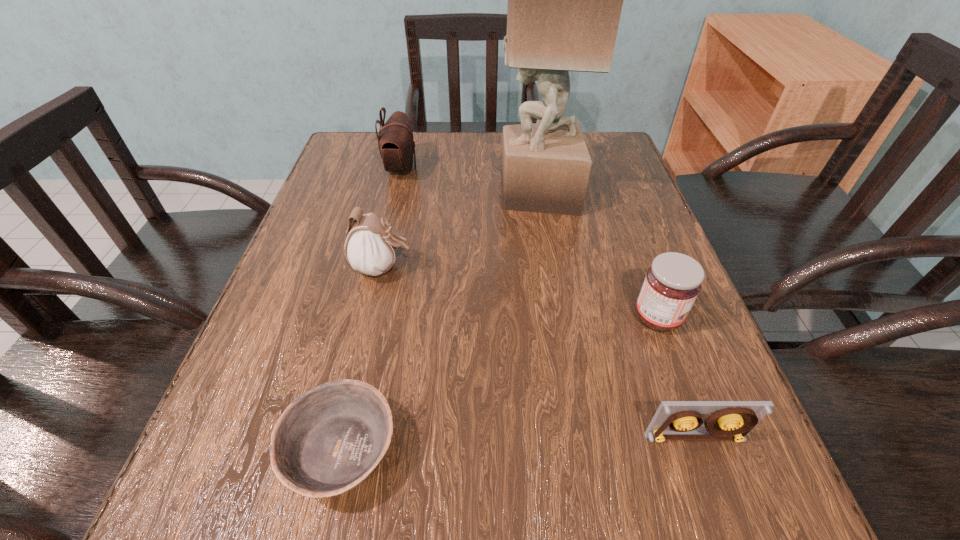
The image size is (960, 540). I want to click on vacant area situated with the flap open on the farther pouch, so click(x=503, y=168).

Locate an element on the screen. The height and width of the screenshot is (540, 960). free space located on the front-facing side of the third farthest object is located at coordinates (624, 268).

Locate an element on the screen. free space located on the left of the jam is located at coordinates (475, 318).

Identify the location of vacant space located at the front of the fifth tallest object with visible reels. Image resolution: width=960 pixels, height=540 pixels. (730, 534).

Image resolution: width=960 pixels, height=540 pixels. I want to click on free space located on the right of the shortest object, so click(x=436, y=451).

At what (x,y) coordinates should I click in order to perform the action: click on sculpture positioned at the far edge. Please return your answer as a coordinate pair (x, y). Image resolution: width=960 pixels, height=540 pixels. Looking at the image, I should click on (565, 0).

The image size is (960, 540). I want to click on pouch at the far edge, so click(x=396, y=144).

This screenshot has width=960, height=540. I want to click on object positioned at the near edge, so click(329, 440).

I want to click on bowl that is positioned at the left edge, so click(x=329, y=440).

At what (x,y) coordinates should I click in order to perform the action: click on sculpture that is at the right edge. Please return your answer as a coordinate pair (x, y). Looking at the image, I should click on (565, 0).